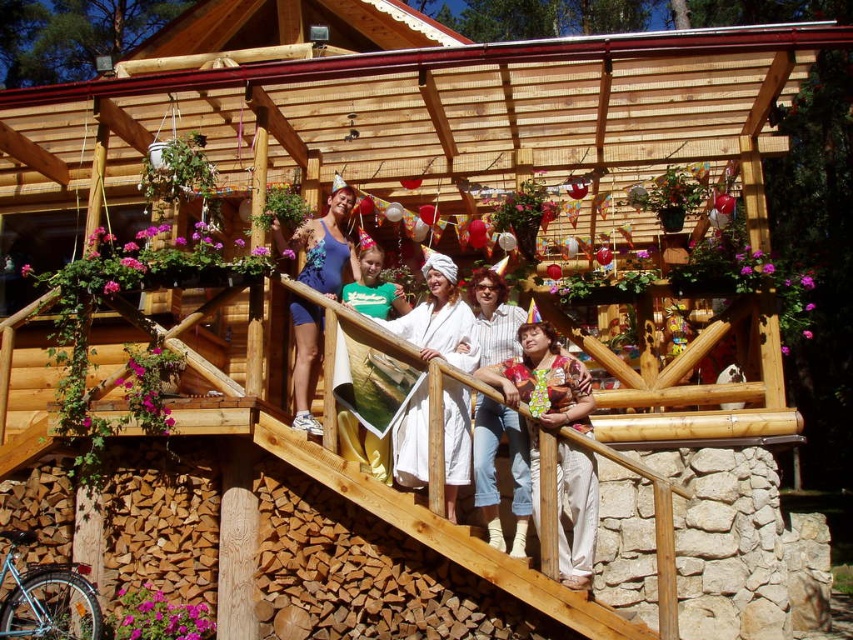
Question: Considering the real-world distances, which object is closest to the blue fabric swimsuit at upper center?

Choices:
 (A) white cotton bathrobe at center
 (B) green cotton shirt at center

Answer: (B)

Question: Which is farther from the white cotton bathrobe at center?

Choices:
 (A) green cotton shirt at center
 (B) blue fabric swimsuit at upper center

Answer: (B)

Question: Observing the image, what is the correct spatial positioning of blue fabric swimsuit at upper center in reference to green cotton shirt at center?

Choices:
 (A) left
 (B) right

Answer: (A)

Question: Which point is farther from the camera taking this photo?

Choices:
 (A) (448, 259)
 (B) (299, 227)
 (C) (393, 292)

Answer: (B)

Question: Can you confirm if blue fabric swimsuit at upper center is positioned to the left of green cotton shirt at center?

Choices:
 (A) no
 (B) yes

Answer: (B)

Question: Can you confirm if blue fabric swimsuit at upper center is bigger than green cotton shirt at center?

Choices:
 (A) no
 (B) yes

Answer: (B)